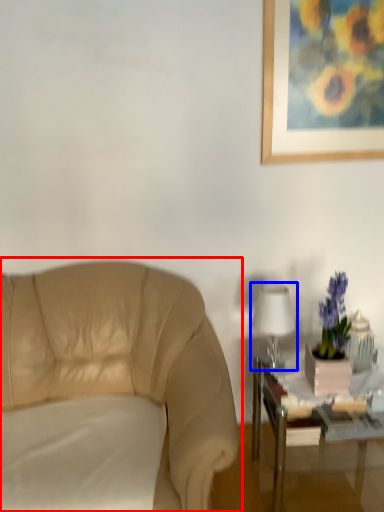
Question: Which object appears farthest to the camera in this image, chair (highlighted by a red box) or table lamp (highlighted by a blue box)?

Choices:
 (A) chair
 (B) table lamp

Answer: (B)